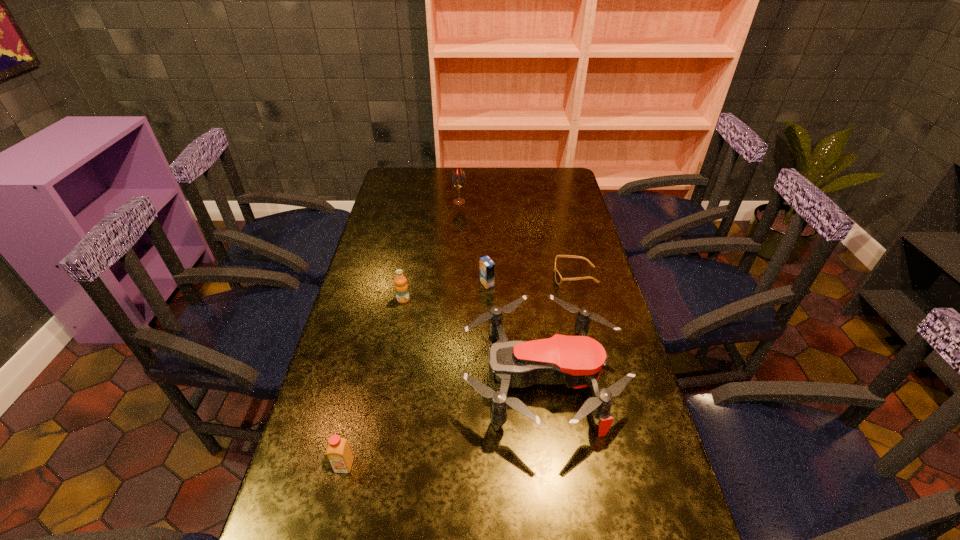
Where is `vacant space located on the right of the fourth object from right to left`? This screenshot has width=960, height=540. vacant space located on the right of the fourth object from right to left is located at coordinates (479, 202).

Locate an element on the screen. free space located on the camera side of the drone is located at coordinates (410, 380).

Find the location of `free point located 0.240m on the camera side of the drone`. free point located 0.240m on the camera side of the drone is located at coordinates (372, 380).

The image size is (960, 540). I want to click on vacant space situated 0.090m on the camera side of the drone, so click(428, 380).

The width and height of the screenshot is (960, 540). What are the coordinates of `vacant region located 0.270m on the label of the fourth farthest object` in the screenshot? It's located at (389, 374).

The height and width of the screenshot is (540, 960). Find the location of `vacant area situated on the front and back of the leftmost object`. vacant area situated on the front and back of the leftmost object is located at coordinates (337, 497).

Identify the location of free space located 0.390m on the front of the shortest orange_juice. The width and height of the screenshot is (960, 540). (489, 390).

At what (x,y) coordinates should I click in order to perform the action: click on free spot located on the front-facing side of the shortest object. Please return your answer as a coordinate pair (x, y). Looking at the image, I should click on (x=451, y=276).

You are a GUI agent. You are given a task and a screenshot of the screen. Output one action in this format:
    pyautogui.click(x=<x>, y=<y>)
    Task: Click on the vacant space located on the front-facing side of the shortest object
    Image resolution: width=960 pixels, height=540 pixels.
    Given the screenshot: What is the action you would take?
    pos(468,276)

Find the location of `vacant area situated 0.310m on the front-facing side of the shortest object`. vacant area situated 0.310m on the front-facing side of the shortest object is located at coordinates (463, 276).